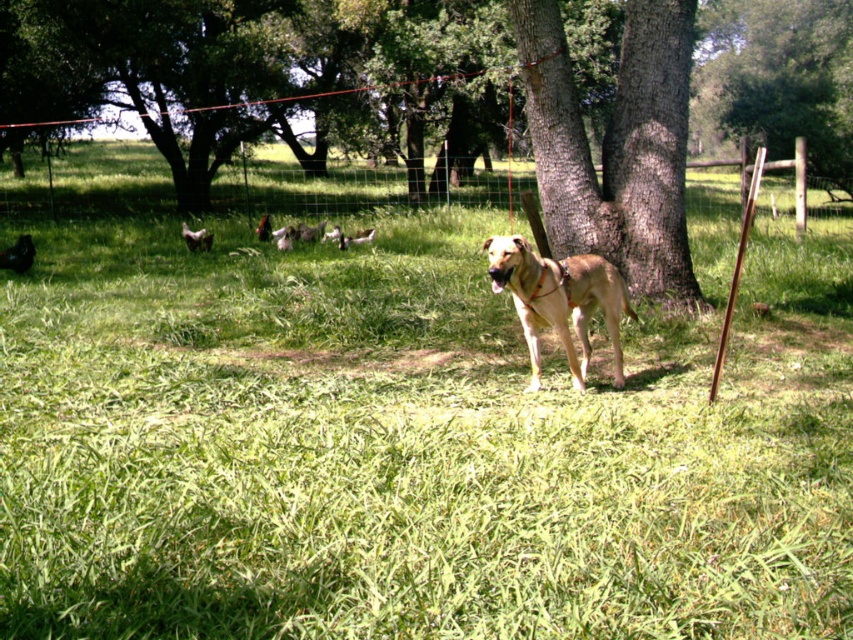
Question: Which object appears closest to the camera in this image?

Choices:
 (A) brown rough bark tree at center
 (B) wire mesh fence at center

Answer: (A)

Question: Which point is closer to the camera taking this photo?

Choices:
 (A) (566, 291)
 (B) (216, 212)
 (C) (654, 179)

Answer: (A)

Question: Is wire mesh fence at center in front of light brown fur at center?

Choices:
 (A) no
 (B) yes

Answer: (A)

Question: Is wire mesh fence at center closer to the viewer compared to light brown fur at center?

Choices:
 (A) yes
 (B) no

Answer: (B)

Question: Can you confirm if brown rough bark tree at center is wider than wire mesh fence at center?

Choices:
 (A) no
 (B) yes

Answer: (A)

Question: Among these objects, which one is nearest to the camera?

Choices:
 (A) brown rough bark tree at center
 (B) light brown fur at center
 (C) wire mesh fence at center

Answer: (B)